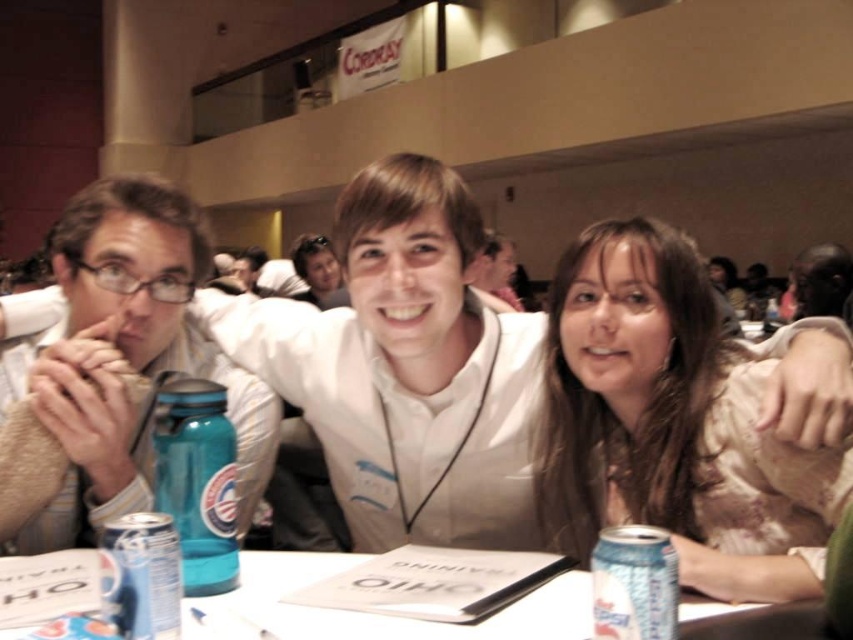
Question: Which point is farther to the camera?

Choices:
 (A) (38, 410)
 (B) (518, 305)

Answer: (B)

Question: Among these points, which one is farthest from the camera?

Choices:
 (A) (462, 500)
 (B) (299, 237)

Answer: (B)

Question: Can you confirm if matte beige sweater at left is smaller than teal plastic water bottle at center?

Choices:
 (A) no
 (B) yes

Answer: (A)

Question: Which of these objects is positioned farthest from the matte black hair at upper center?

Choices:
 (A) smooth black hair at upper right
 (B) clear plastic can at lower center
 (C) silver metallic can at lower left
 (D) teal plastic water bottle at center

Answer: (C)

Question: Does matte white shirt at center have a lesser width compared to smooth black hair at upper right?

Choices:
 (A) yes
 (B) no

Answer: (B)

Question: Observing the image, what is the correct spatial positioning of matte beige sweater at left in reference to clear plastic can at lower center?

Choices:
 (A) below
 (B) above

Answer: (B)